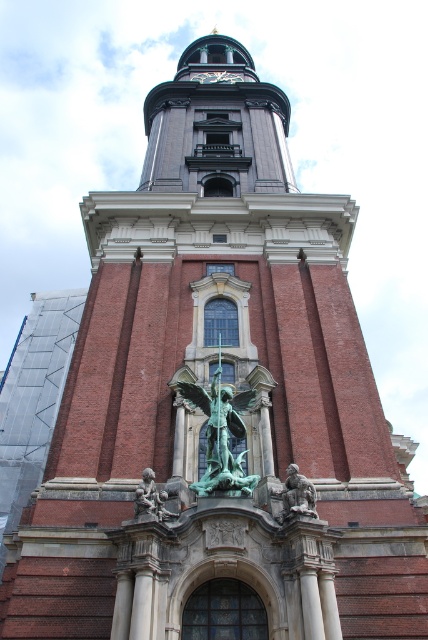
Question: Considering the real-world distances, which object is farthest from the green patina statue at center?

Choices:
 (A) green patina statue at lower center
 (B) bronze statue at center

Answer: (B)

Question: Is green patina statue at center closer to the viewer compared to green patina statue at lower center?

Choices:
 (A) no
 (B) yes

Answer: (A)

Question: Among these objects, which one is farthest from the camera?

Choices:
 (A) bronze statue at center
 (B) green patina statue at lower center
 (C) green patina statue at center

Answer: (C)

Question: Is green patina statue at center further to camera compared to bronze statue at center?

Choices:
 (A) yes
 (B) no

Answer: (A)

Question: Which point is closer to the camera?

Choices:
 (A) (232, 413)
 (B) (294, 480)
 (C) (140, 497)

Answer: (C)

Question: Is green patina statue at center further to the viewer compared to green patina statue at lower center?

Choices:
 (A) no
 (B) yes

Answer: (B)